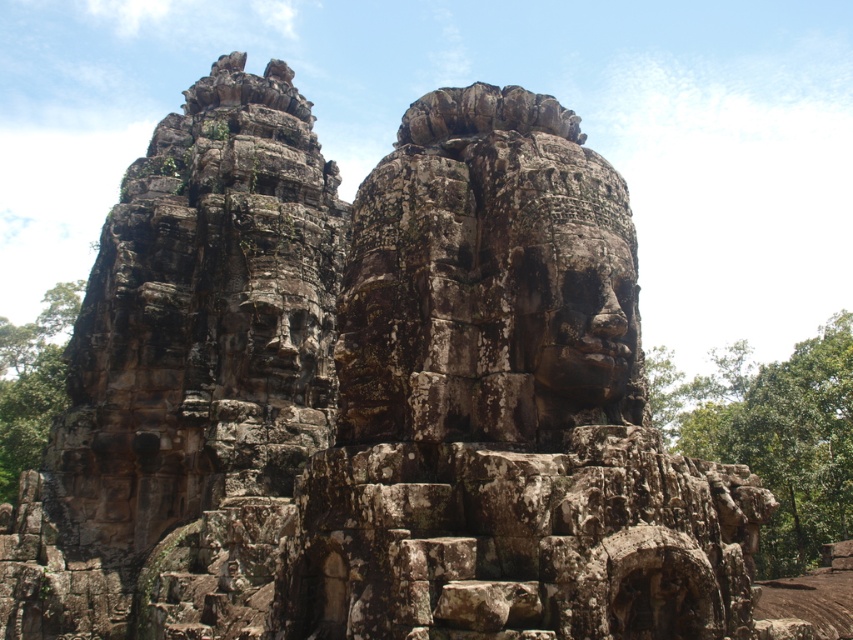
Question: Does green leafy tree at right lie in front of rough stone face at center?

Choices:
 (A) yes
 (B) no

Answer: (A)

Question: Estimate the real-world distances between objects in this image. Which object is closer to the rough stone face at center?

Choices:
 (A) green leafy tree at right
 (B) green leafy tree at lower left

Answer: (A)

Question: Is rough stone face at center below green leafy tree at lower left?

Choices:
 (A) yes
 (B) no

Answer: (B)

Question: Which of the following is the closest to the observer?

Choices:
 (A) green leafy tree at right
 (B) rough stone face at center
 (C) green leafy tree at lower left

Answer: (A)

Question: Can you confirm if rough stone face at center is smaller than green leafy tree at lower left?

Choices:
 (A) no
 (B) yes

Answer: (B)

Question: Which object is positioned farthest from the rough stone face at center?

Choices:
 (A) green leafy tree at right
 (B) green leafy tree at lower left

Answer: (B)